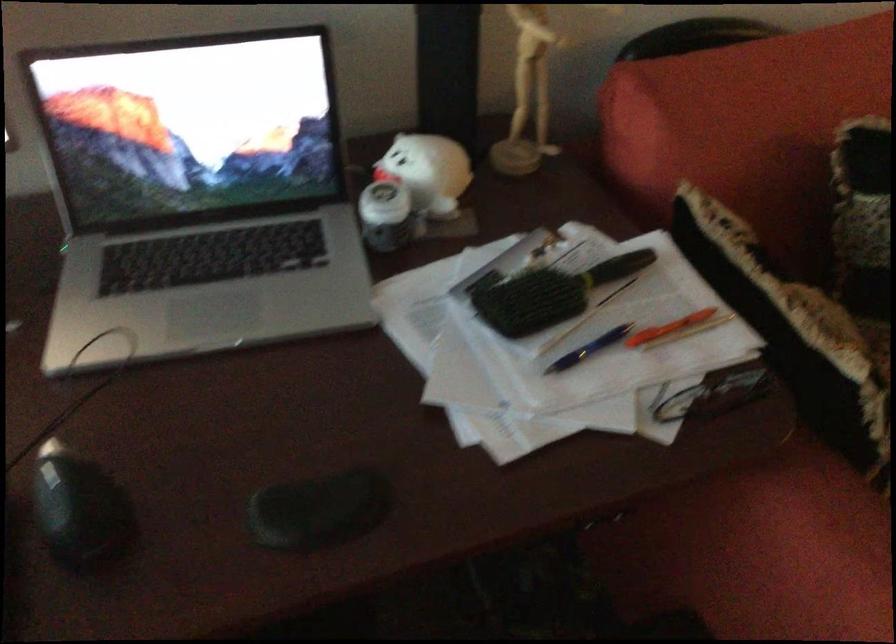
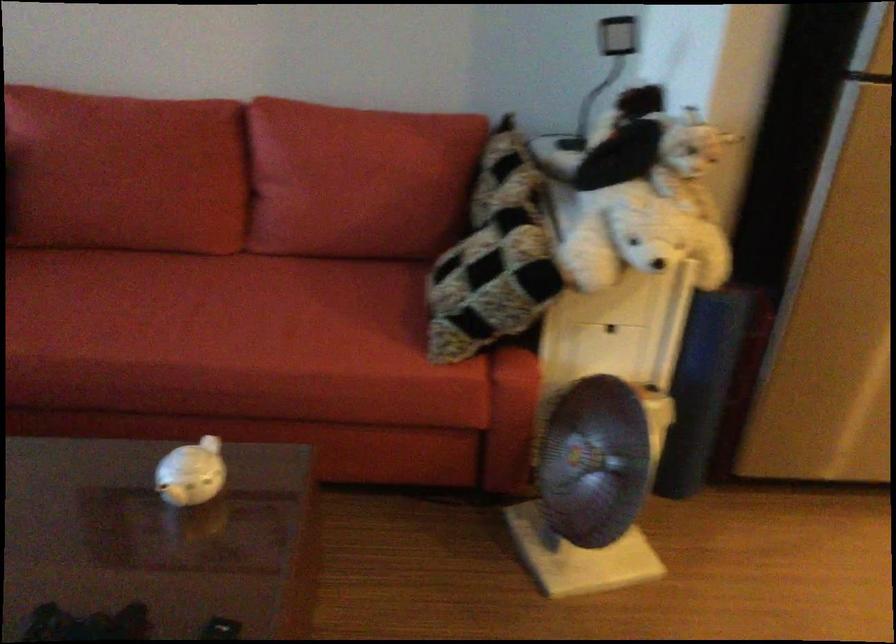
Question: Which direction would the cameraman need to move to produce the second image? Reply with the corresponding letter.

Choices:
 (A) Left
 (B) Right
 (C) Forward
 (D) Backward

Answer: (B)